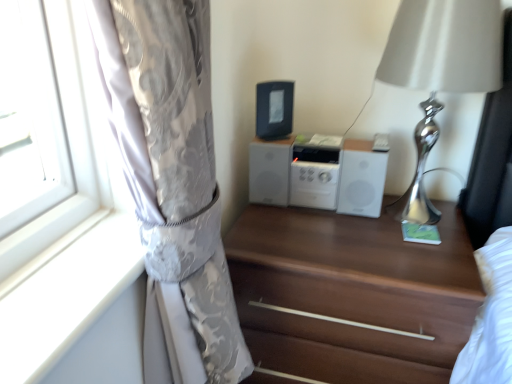
Where is `free point above brown wood chest of drawers at center (from a real-world perspective)`? The image size is (512, 384). free point above brown wood chest of drawers at center (from a real-world perspective) is located at coordinates (349, 237).